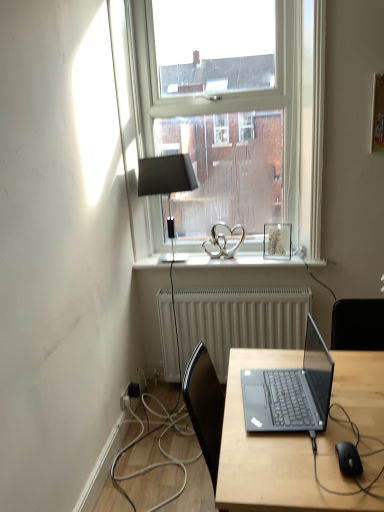
Locate an element on the screen. unoccupied space behind black matte computer mouse at lower right is located at coordinates (343, 425).